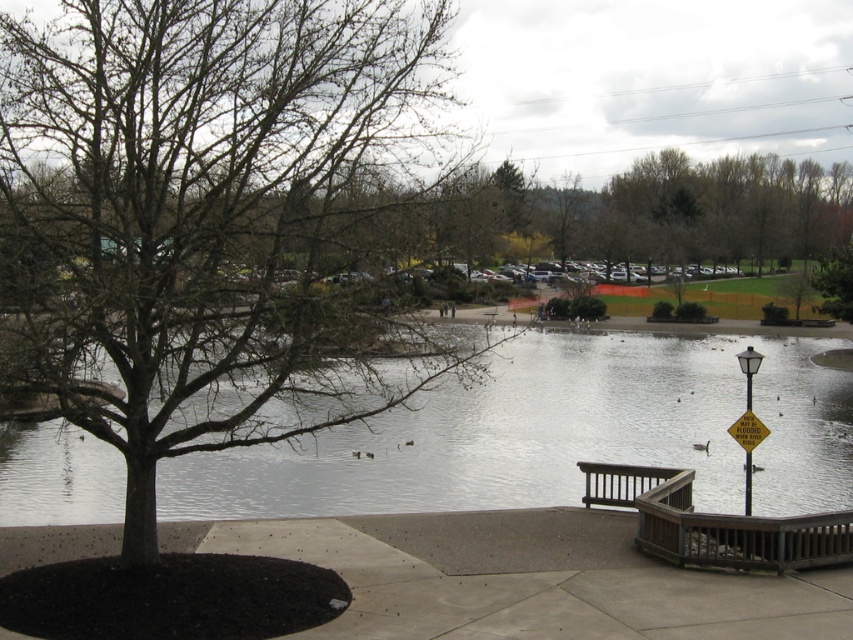
I want to click on clear water at center, so click(555, 435).

The width and height of the screenshot is (853, 640). In order to click on clear water at center in this screenshot , I will do `click(555, 435)`.

You are a GUI agent. You are given a task and a screenshot of the screen. Output one action in this format:
    pyautogui.click(x=<x>, y=<y>)
    Task: Click on the clear water at center
    This screenshot has height=640, width=853.
    Given the screenshot: What is the action you would take?
    pyautogui.click(x=555, y=435)

What do you see at coordinates (619, 481) in the screenshot?
I see `brown wooden bench at lower right` at bounding box center [619, 481].

Can you confirm if brown wooden bench at lower right is thinner than yellow paper street sign at lower right?

No.

Locate an element on the screen. The height and width of the screenshot is (640, 853). brown wooden bench at lower right is located at coordinates (619, 481).

Find the location of a particular element. brown wooden bench at lower right is located at coordinates (619, 481).

Is clear water at center smaller than yellow paper street sign at right?

No.

Is the position of clear water at center more distant than that of yellow paper street sign at right?

That is False.

Who is more forward, (352, 436) or (747, 477)?

Positioned in front is point (747, 477).

This screenshot has height=640, width=853. What are the coordinates of `clear water at center` in the screenshot? It's located at (555, 435).